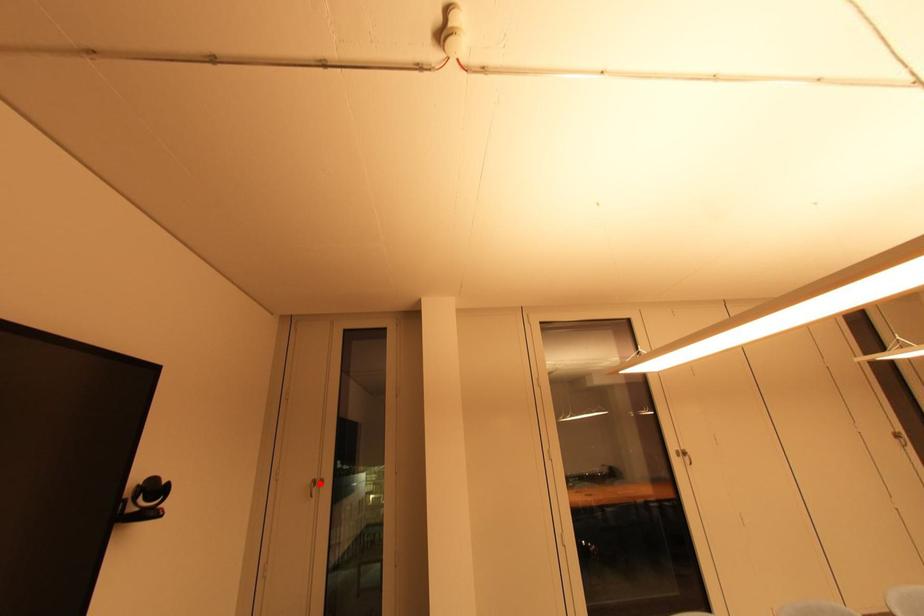
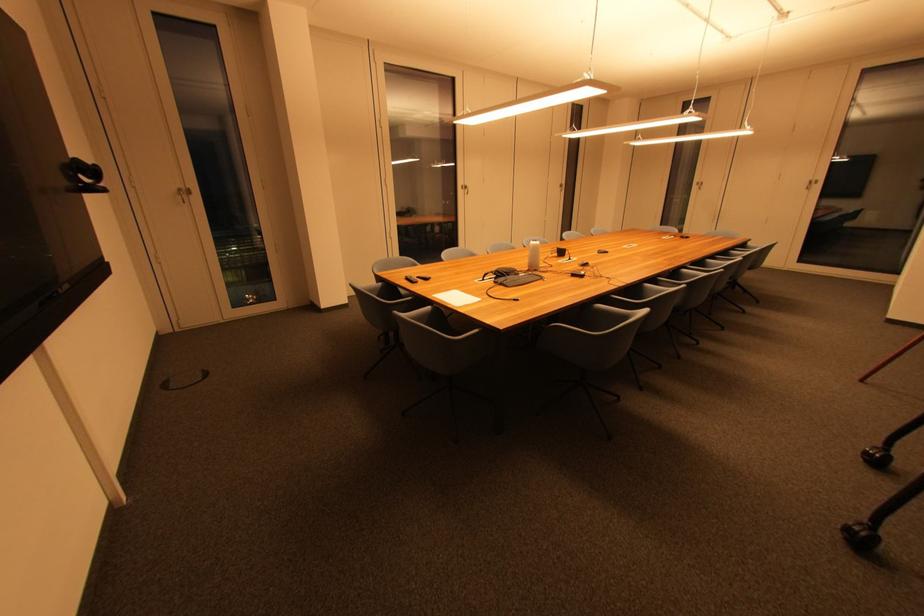
Where in the second image is the point corresponding to the highlighted location from the first image?

(185, 192)